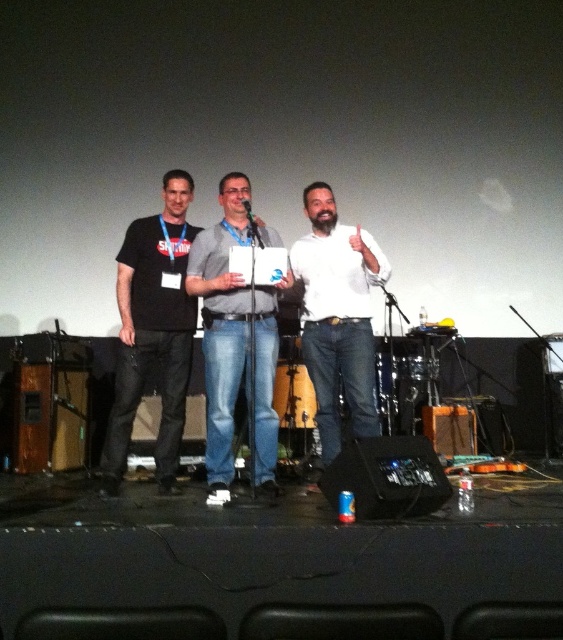
Question: Which of the following is the closest to the observer?

Choices:
 (A) black matte t-shirt at left
 (B) white matte shirt at center

Answer: (A)

Question: Is the position of black matte t-shirt at left less distant than that of gray fabric shirt at center?

Choices:
 (A) no
 (B) yes

Answer: (A)

Question: Does gray fabric shirt at center appear over white matte shirt at center?

Choices:
 (A) yes
 (B) no

Answer: (B)

Question: Among these points, which one is nearest to the camera?

Choices:
 (A) (209, 324)
 (B) (172, 182)
 (C) (323, 192)

Answer: (A)

Question: Observing the image, what is the correct spatial positioning of black matte t-shirt at left in reference to white matte shirt at center?

Choices:
 (A) right
 (B) left

Answer: (B)

Question: Which object is the closest to the gray fabric shirt at center?

Choices:
 (A) black matte t-shirt at left
 (B) white matte shirt at center

Answer: (A)